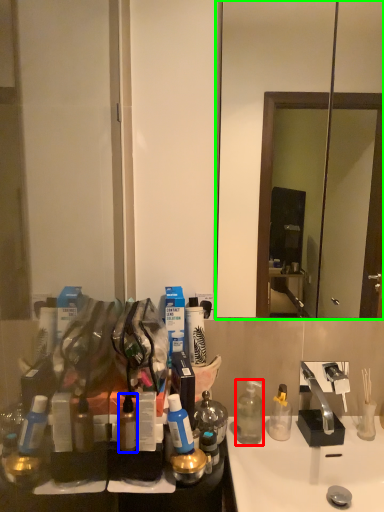
Question: Estimate the real-world distances between objects in this image. Which object is closer to bottle (highlighted by a red box), bottle (highlighted by a blue box) or mirror (highlighted by a green box)?

Choices:
 (A) bottle
 (B) mirror

Answer: (A)